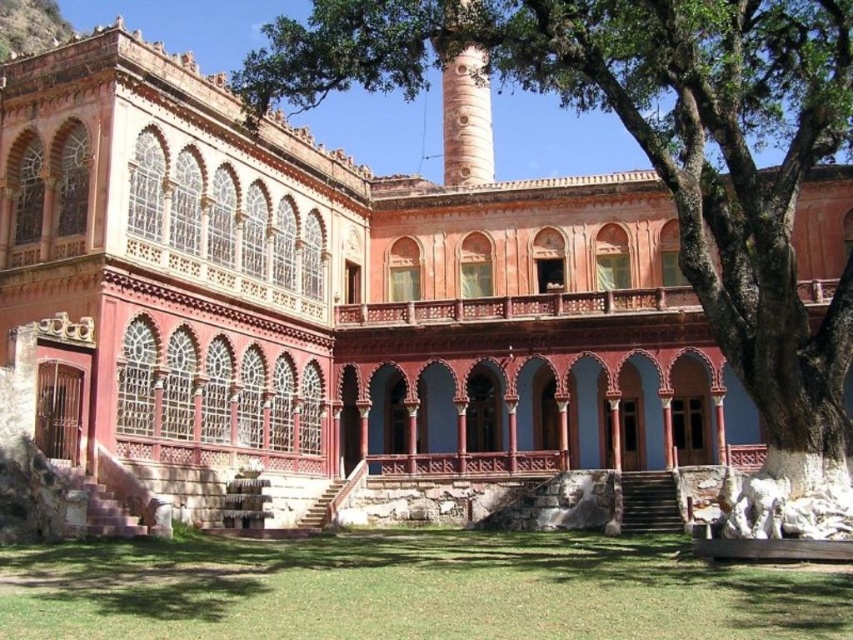
Question: Which point is closer to the camera taking this photo?

Choices:
 (A) 758,392
 (B) 561,573

Answer: (B)

Question: Does green leafy tree at upper center have a larger size compared to green grass at lower center?

Choices:
 (A) no
 (B) yes

Answer: (B)

Question: Which of the following is the farthest from the observer?

Choices:
 (A) (842, 326)
 (B) (62, 616)

Answer: (A)

Question: Is green leafy tree at upper center thinner than green grass at lower center?

Choices:
 (A) no
 (B) yes

Answer: (A)

Question: Can you confirm if green leafy tree at upper center is positioned below green grass at lower center?

Choices:
 (A) yes
 (B) no

Answer: (B)